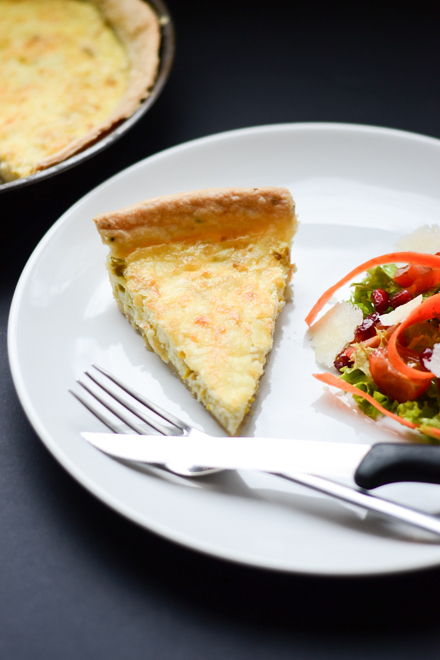
Where is `black table`? black table is located at coordinates (147, 610).